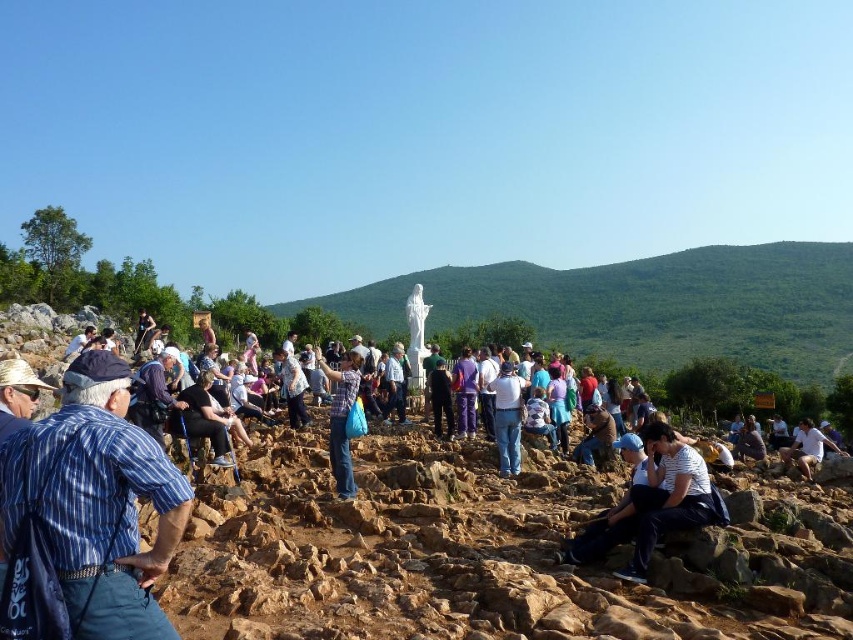
Find the location of a particular element. This screenshot has height=640, width=853. striped cotton shirt at lower right is located at coordinates (666, 497).

Which is more to the left, striped cotton shirt at lower right or white cotton shirt at center?

From the viewer's perspective, striped cotton shirt at lower right appears more on the left side.

Who is more forward, (x=660, y=476) or (x=817, y=440)?

Positioned in front is point (x=660, y=476).

Locate an element on the screen. This screenshot has height=640, width=853. striped cotton shirt at lower right is located at coordinates (666, 497).

Which is in front, point (115, 358) or point (651, 470)?

Positioned in front is point (115, 358).

Which is behind, point (30, 536) or point (666, 432)?

The point (666, 432) is behind.

Which is in front, point (77, 560) or point (682, 467)?

Point (77, 560)

Find the location of `blue striped shirt at center`. blue striped shirt at center is located at coordinates (86, 515).

Does blue striped shirt at center appear under white fabric shirt at center?

No.

Looking at this image, who is more forward, (184, 506) or (503, 444)?

Point (184, 506) is in front.

Between point (119, 433) and point (502, 413), which one is positioned in front?

Positioned in front is point (119, 433).

Where is `blue striped shirt at center`? This screenshot has height=640, width=853. blue striped shirt at center is located at coordinates (86, 515).